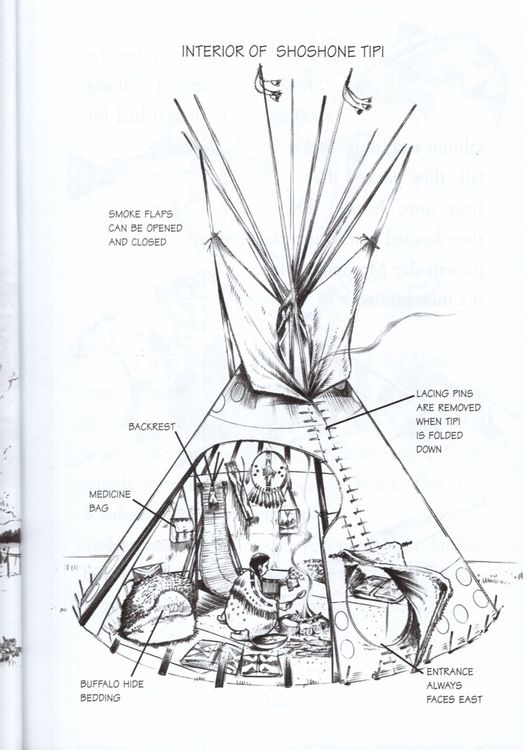
Locate an element on the screen. The width and height of the screenshot is (523, 750). native american cooking ware is located at coordinates (274, 636).